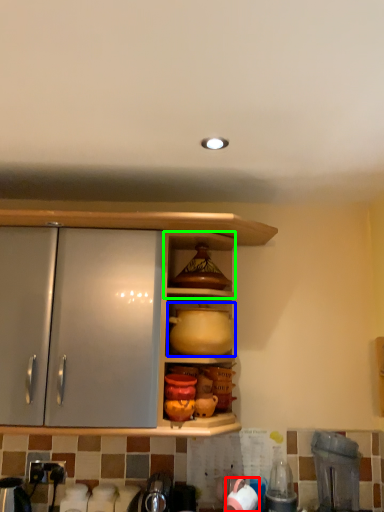
Question: Estimate the real-world distances between objects in this image. Which object is farther from tableware (highlighted by a red box), pottery (highlighted by a blue box) or shelf (highlighted by a green box)?

Choices:
 (A) pottery
 (B) shelf

Answer: (B)